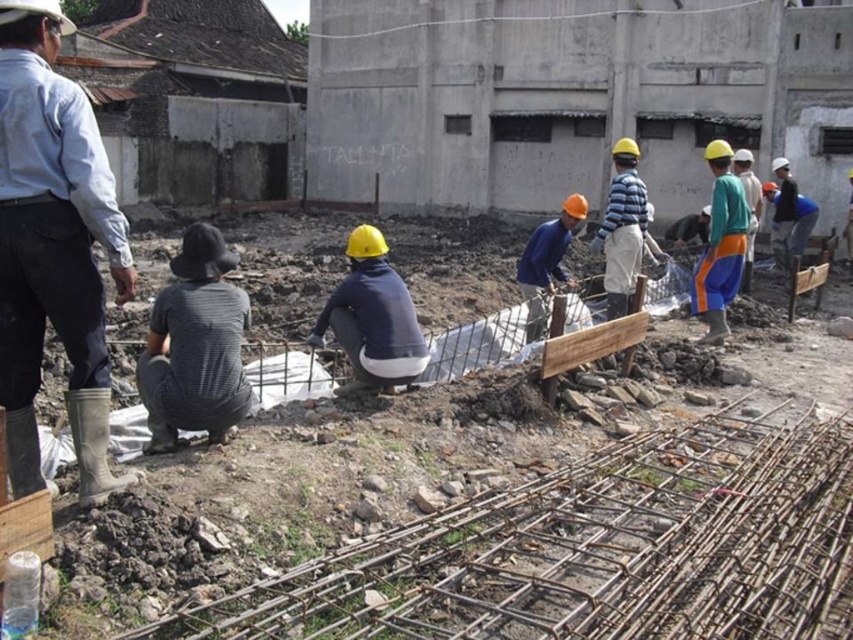
You are a construction inspector standing at the camera position. You need to check two points on the site for safety compliance. The first point is at coordinates point [207,397] and the second is at point [546,278]. Which point should you inspect first if you want to check the closer one first?

Point [207,397] is closer to the camera than point [546,278], so you should inspect point [207,397] first.

You are a safety inspector on the construction site. You need to ensure that all workers are wearing their hard hats properly. Which worker is more likely to be violating safety protocols, the dark gray cotton shirt at lower left or the blue matte shirt at center?

The dark gray cotton shirt at lower left might be wider than blue matte shirt at center, so it is more likely to be violating safety protocols if the width indicates improper hat placement.